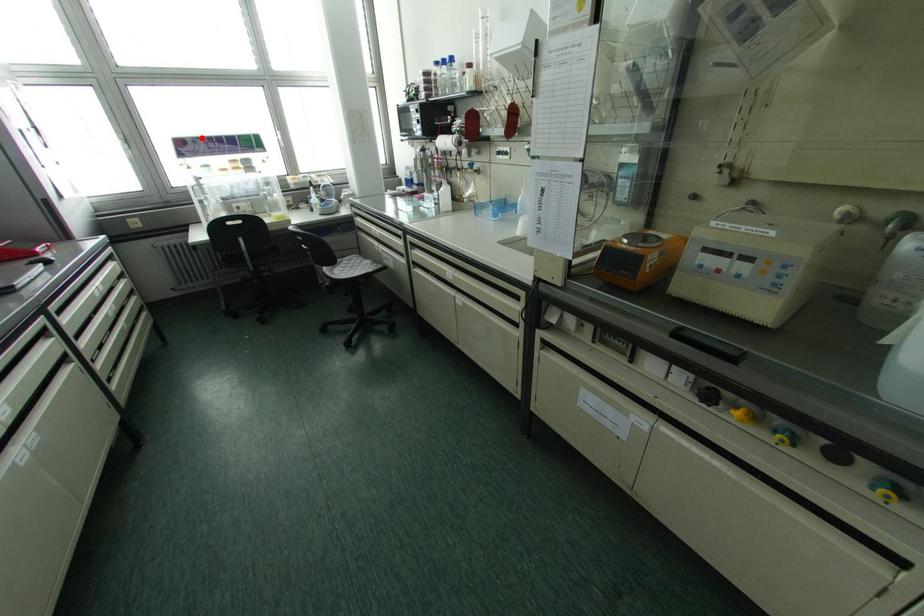
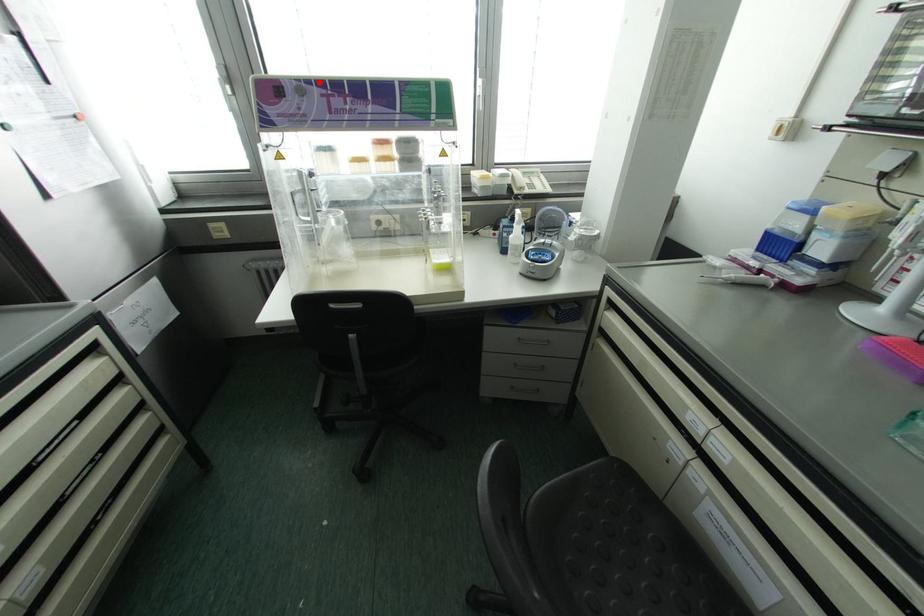
I am providing you with two images of the same scene from different viewpoints. A red point is marked on the first image and another point is marked on the second image. Is the red point in image1 aligned with the point shown in image2?

Yes